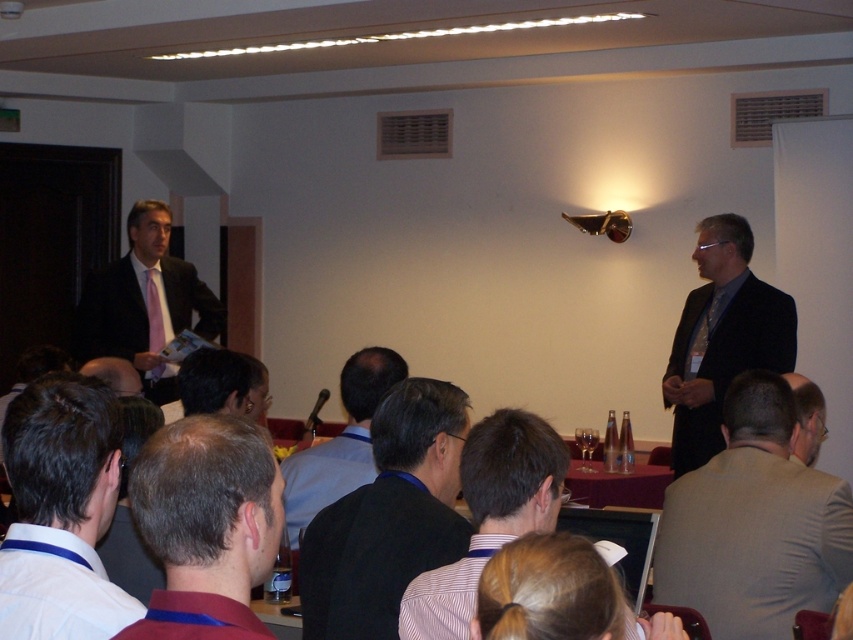
Question: Is white shirt at lower left bigger than brown hair at center?

Choices:
 (A) no
 (B) yes

Answer: (B)

Question: Which of these objects is positioned farthest from the white shirt at lower left?

Choices:
 (A) dark gray suit at center
 (B) black velvet suit at right
 (C) brown hair at center

Answer: (B)

Question: Estimate the real-world distances between objects in this image. Which object is closer to the black velvet suit at right?

Choices:
 (A) matte black suit at center
 (B) brown hair at center

Answer: (A)

Question: Which object is the closest to the black velvet suit at right?

Choices:
 (A) matte black suit at left
 (B) white shirt at lower left

Answer: (A)

Question: Considering the relative positions of black fabric jacket at center and matte black suit at center in the image provided, where is black fabric jacket at center located with respect to matte black suit at center?

Choices:
 (A) left
 (B) right

Answer: (A)

Question: In this image, where is light gray suit at right located relative to matte black suit at left?

Choices:
 (A) left
 (B) right

Answer: (B)